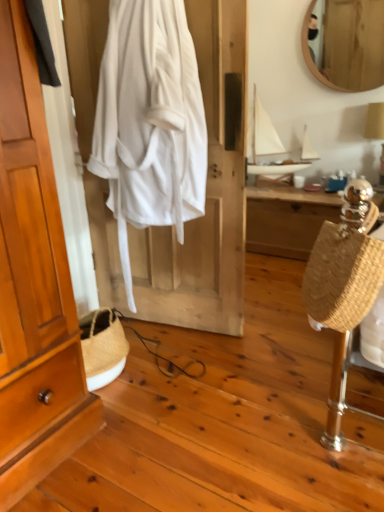
Question: Is wooden wardrobe at left wider than white matte sailboat at upper center?

Choices:
 (A) yes
 (B) no

Answer: (B)

Question: Is wooden wardrobe at left to the right of white matte sailboat at upper center from the viewer's perspective?

Choices:
 (A) yes
 (B) no

Answer: (B)

Question: Considering the relative positions of wooden wardrobe at left and white matte sailboat at upper center in the image provided, is wooden wardrobe at left to the left of white matte sailboat at upper center from the viewer's perspective?

Choices:
 (A) yes
 (B) no

Answer: (A)

Question: Is the depth of wooden wardrobe at left greater than that of white matte sailboat at upper center?

Choices:
 (A) no
 (B) yes

Answer: (A)

Question: From a real-world perspective, is wooden wardrobe at left located higher than white matte sailboat at upper center?

Choices:
 (A) yes
 (B) no

Answer: (A)

Question: Considering the positions of wooden mirror at upper right and braided straw bag at right in the image, is wooden mirror at upper right taller or shorter than braided straw bag at right?

Choices:
 (A) short
 (B) tall

Answer: (B)

Question: From a real-world perspective, is wooden mirror at upper right positioned above or below braided straw bag at right?

Choices:
 (A) below
 (B) above

Answer: (B)

Question: Is wooden mirror at upper right wider or thinner than braided straw bag at right?

Choices:
 (A) wide
 (B) thin

Answer: (B)

Question: Does point (342, 29) appear closer or farther from the camera than point (347, 283)?

Choices:
 (A) closer
 (B) farther

Answer: (B)

Question: Do you think wooden mirror at upper right is within white cotton robe at center, or outside of it?

Choices:
 (A) outside
 (B) inside

Answer: (A)

Question: Is wooden mirror at upper right wider or thinner than white cotton robe at center?

Choices:
 (A) thin
 (B) wide

Answer: (A)

Question: Considering the positions of point (369, 70) and point (137, 184), is point (369, 70) closer or farther from the camera than point (137, 184)?

Choices:
 (A) closer
 (B) farther

Answer: (B)

Question: From the image's perspective, relative to white cotton robe at center, is wooden mirror at upper right above or below?

Choices:
 (A) above
 (B) below

Answer: (A)

Question: Is braided straw bag at right bigger or smaller than wooden mirror at upper right?

Choices:
 (A) big
 (B) small

Answer: (B)

Question: Considering the positions of braided straw bag at right and wooden mirror at upper right in the image, is braided straw bag at right taller or shorter than wooden mirror at upper right?

Choices:
 (A) tall
 (B) short

Answer: (B)